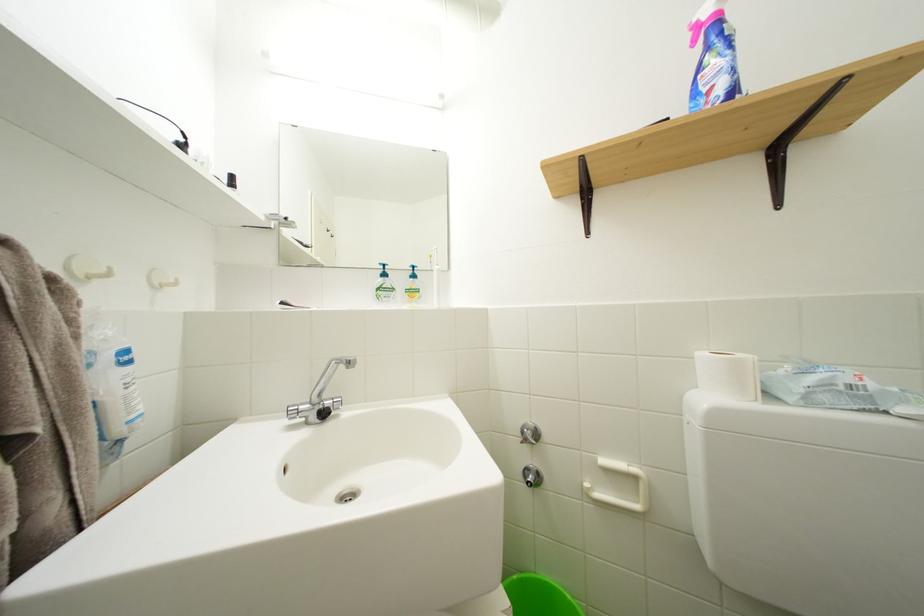
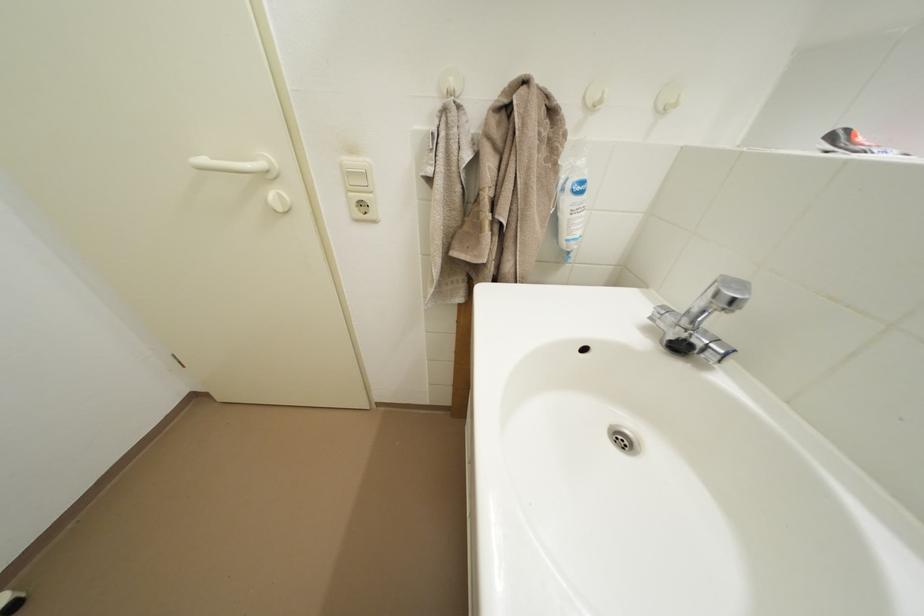
Based on the continuous images, in which direction is the camera rotating?

The camera rotated toward left-down.